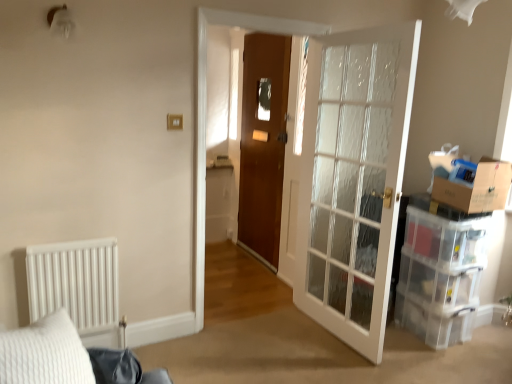
Where is `vacant space situated on the left part of clear glass door at right`? This screenshot has height=384, width=512. vacant space situated on the left part of clear glass door at right is located at coordinates [x=260, y=341].